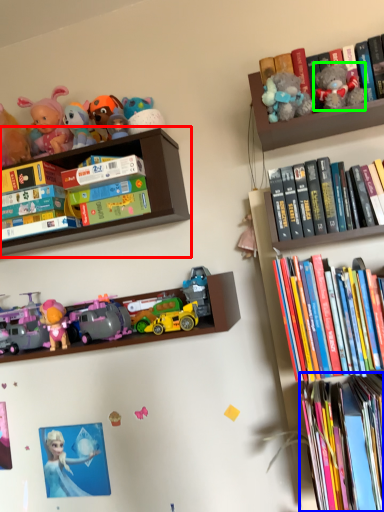
Question: Which object is the farthest from shelf (highlighted by a red box)? Choose among these: book (highlighted by a blue box) or toy (highlighted by a green box).

Choices:
 (A) book
 (B) toy

Answer: (A)